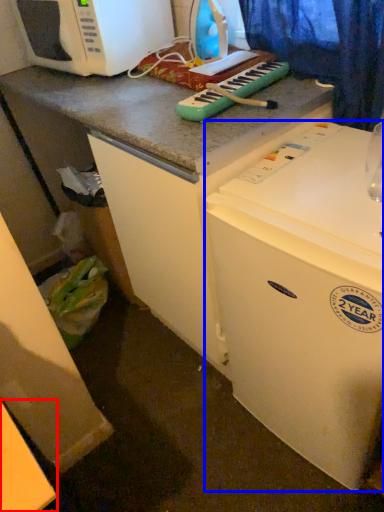
Question: Which object is further to the camera taking this photo, counter top (highlighted by a red box) or refrigerator (highlighted by a blue box)?

Choices:
 (A) counter top
 (B) refrigerator

Answer: (B)